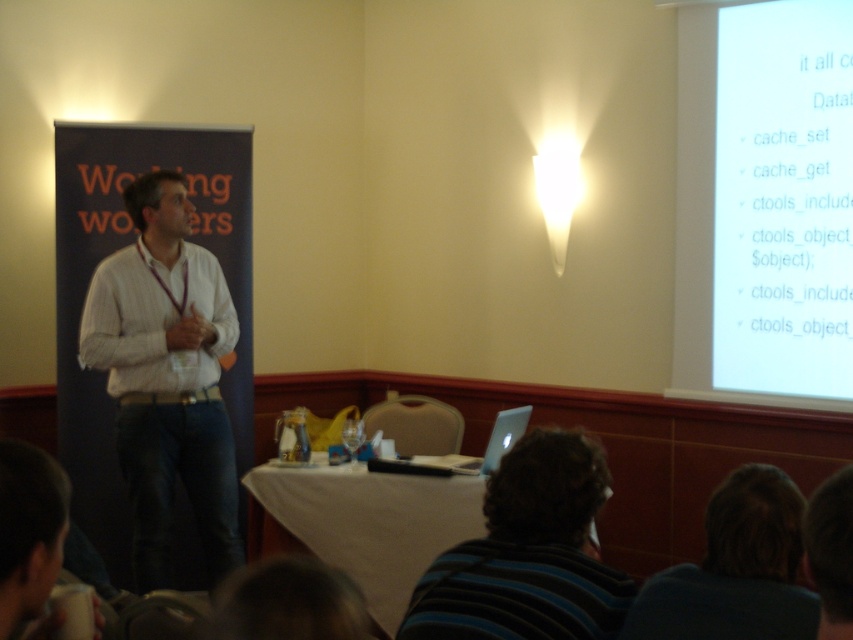
Which is behind, point (194, 317) or point (276, 509)?

The point (276, 509) is behind.

Is white striped shirt at center positioned behind white cloth at center?

That is True.

Locate an element on the screen. The width and height of the screenshot is (853, 640). white striped shirt at center is located at coordinates (166, 378).

Can you confirm if white glossy projector screen at upper right is positioned above white cloth at center?

Yes, white glossy projector screen at upper right is above white cloth at center.

Can you confirm if white glossy projector screen at upper right is positioned to the right of white cloth at center?

Yes, white glossy projector screen at upper right is to the right of white cloth at center.

Does point (699, 10) come farther from viewer compared to point (422, 548)?

Yes, point (699, 10) is farther from viewer.

Where is `white glossy projector screen at upper right`? Image resolution: width=853 pixels, height=640 pixels. white glossy projector screen at upper right is located at coordinates (764, 204).

Looking at this image, is dark brown hair at upper center wider than white cloth at center?

No.

Can you confirm if dark brown hair at upper center is shorter than white cloth at center?

Yes.

What do you see at coordinates (735, 570) in the screenshot?
I see `dark brown hair at upper center` at bounding box center [735, 570].

This screenshot has width=853, height=640. I want to click on dark brown hair at upper center, so click(735, 570).